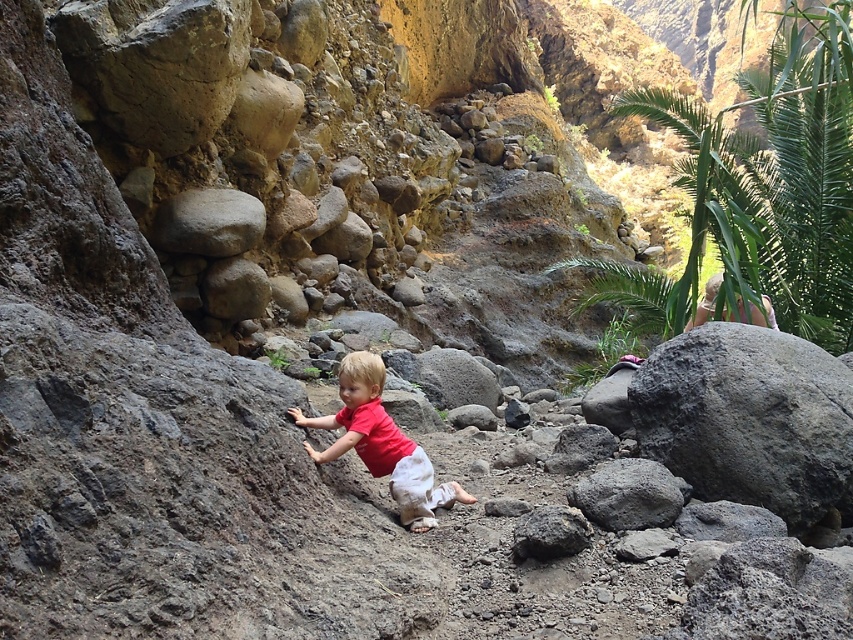
Does point (721, 385) lie behind point (416, 484)?

Yes, point (721, 385) is behind point (416, 484).

Can you confirm if volcanic rock boulder at right is wider than matte red shirt at center?

Correct, the width of volcanic rock boulder at right exceeds that of matte red shirt at center.

Who is more forward, (788, 440) or (398, 449)?

Positioned in front is point (788, 440).

Locate an element on the screen. volcanic rock boulder at right is located at coordinates (749, 419).

Is volcanic rock boulder at right smaller than gray rough rock at upper center?

Actually, volcanic rock boulder at right might be larger than gray rough rock at upper center.

Can you confirm if volcanic rock boulder at right is positioned to the right of gray rough rock at upper center?

Yes, volcanic rock boulder at right is to the right of gray rough rock at upper center.

Between point (694, 339) and point (196, 252), which one is positioned behind?

Point (196, 252)

Identify the location of volcanic rock boulder at right. This screenshot has height=640, width=853. (749, 419).

Between point (770, 442) and point (550, 547), which one is positioned behind?

Positioned behind is point (770, 442).

Between volcanic rock boulder at right and gray rough rock at center, which one appears on the right side from the viewer's perspective?

volcanic rock boulder at right

Measure the distance between point (715, 400) and camera.

Point (715, 400) and camera are 10.47 meters apart from each other.

The width and height of the screenshot is (853, 640). Find the location of `volcanic rock boulder at right`. volcanic rock boulder at right is located at coordinates (749, 419).